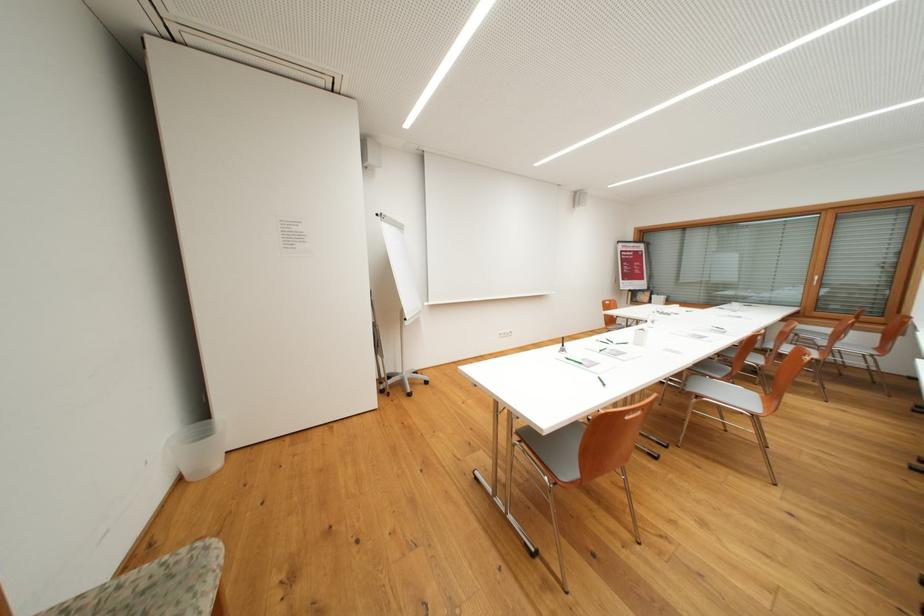
This screenshot has width=924, height=616. Identify the location of wooden window handle. (816, 278).